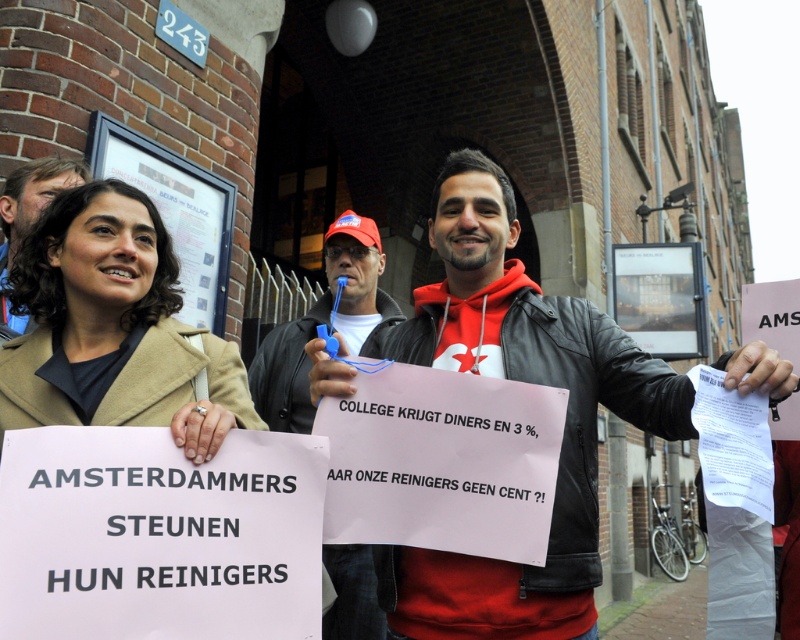
Question: Can you confirm if red leather jacket at center is wider than matte black jacket at center?

Choices:
 (A) no
 (B) yes

Answer: (B)

Question: Does beige wool coat at center have a lesser width compared to matte black jacket at upper left?

Choices:
 (A) yes
 (B) no

Answer: (B)

Question: Estimate the real-world distances between objects in this image. Which object is farther from the matte black jacket at center?

Choices:
 (A) matte black jacket at upper left
 (B) red leather jacket at center

Answer: (A)

Question: Estimate the real-world distances between objects in this image. Which object is farther from the beige wool coat at center?

Choices:
 (A) matte black jacket at center
 (B) red leather jacket at center
 (C) matte black jacket at upper left

Answer: (A)

Question: Which of these objects is positioned closest to the matte black jacket at center?

Choices:
 (A) matte black jacket at upper left
 (B) red leather jacket at center
 (C) beige wool coat at center

Answer: (B)

Question: Is beige wool coat at center below matte black jacket at center?

Choices:
 (A) yes
 (B) no

Answer: (A)